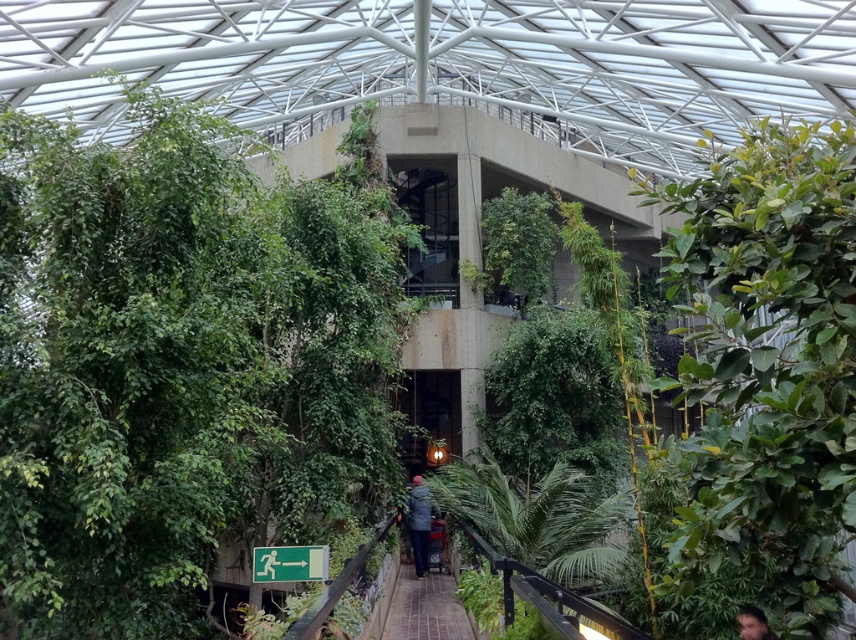
Question: Which object appears closest to the camera in this image?

Choices:
 (A) dark gray fabric jacket at center
 (B) brick paved walkway at center

Answer: (B)

Question: Does brick paved walkway at center have a smaller size compared to dark brown hair at lower right?

Choices:
 (A) no
 (B) yes

Answer: (A)

Question: Which point is closer to the camera?

Choices:
 (A) (753, 614)
 (B) (100, 154)

Answer: (A)

Question: Can you confirm if green leafy tree at center is bigger than dark gray fabric jacket at center?

Choices:
 (A) yes
 (B) no

Answer: (A)

Question: Can you confirm if green leafy tree at left is positioned to the right of dark gray fabric jacket at center?

Choices:
 (A) no
 (B) yes

Answer: (A)

Question: Which is nearer to the green leafy tree at center?

Choices:
 (A) brick paved walkway at center
 (B) green leafy tree at left

Answer: (A)